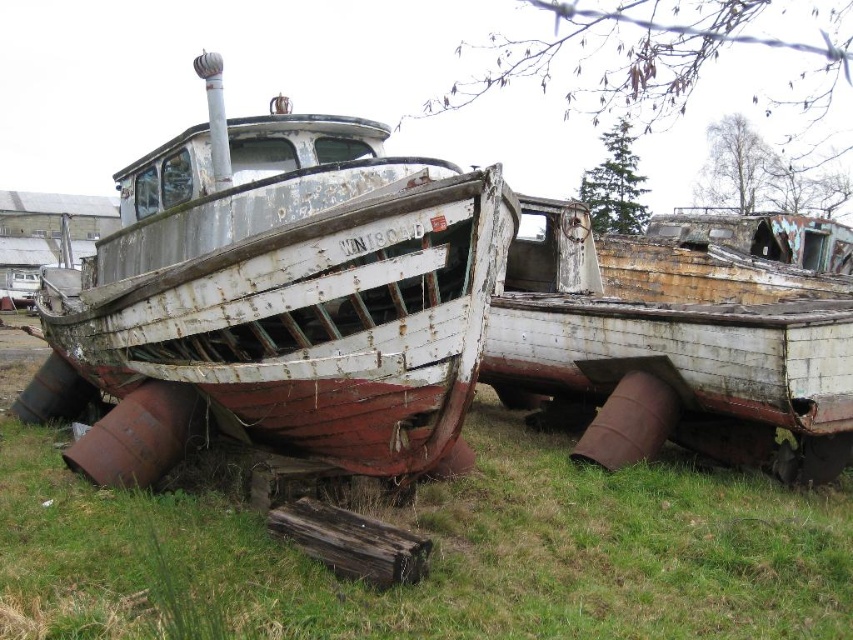
You are an inspector checking the abandoned boats. You see the rusty wood boat at center and the rusty metal boat at center. Which boat is located to the left side of the other?

The rusty wood boat at center is positioned on the left side of the rusty metal boat at center.

You are standing at the point marked by the coordinates point (287, 296) in the image. What object are you directly facing?

You are directly facing the rusty wood boat at center as indicated by the point (287, 296).